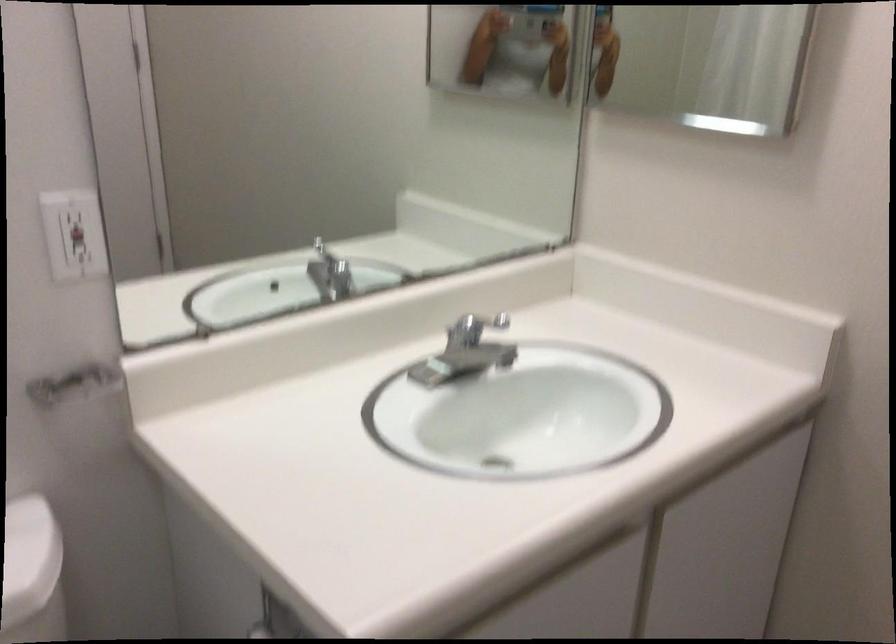
Image resolution: width=896 pixels, height=644 pixels. Find the location of `silver faucet handle`. silver faucet handle is located at coordinates (474, 328).